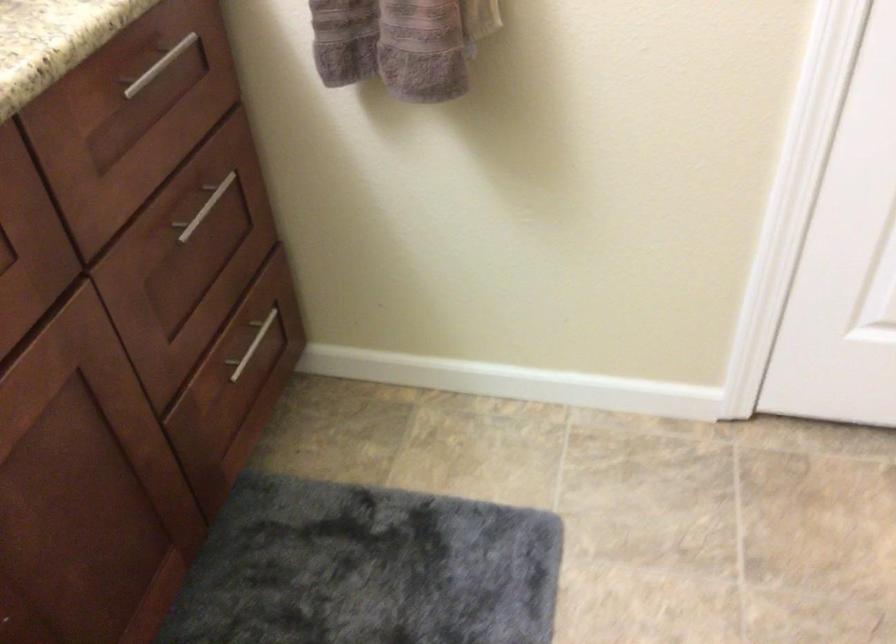
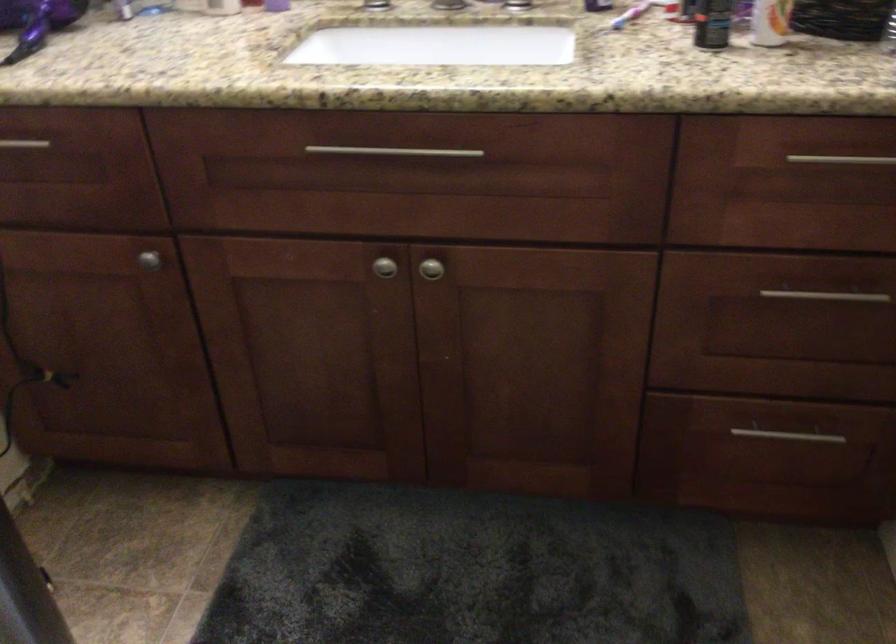
Where in the second image is the point corresponding to (x=153, y=73) from the first image?

(841, 158)